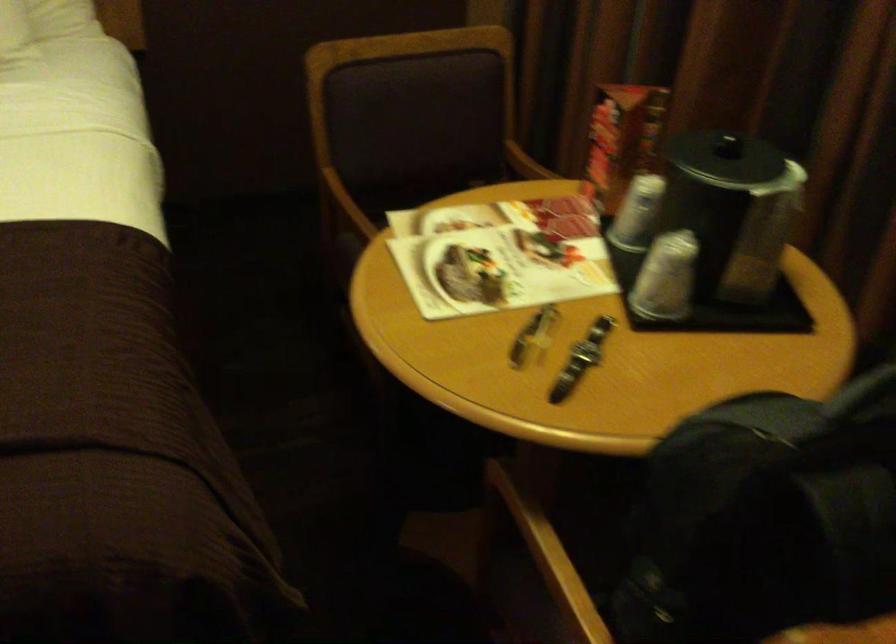
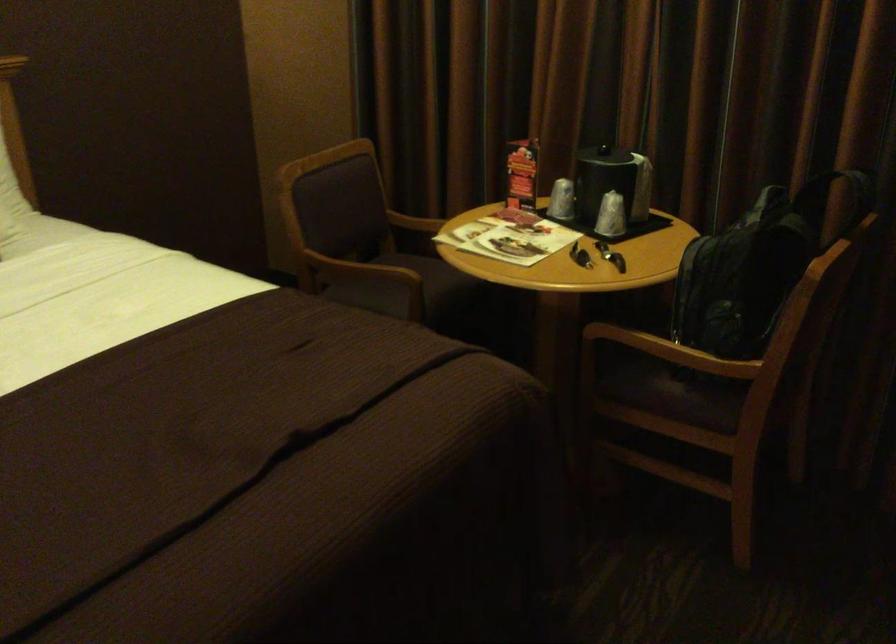
Where in the second image is the point corresponding to point (668, 274) from the first image?

(610, 216)